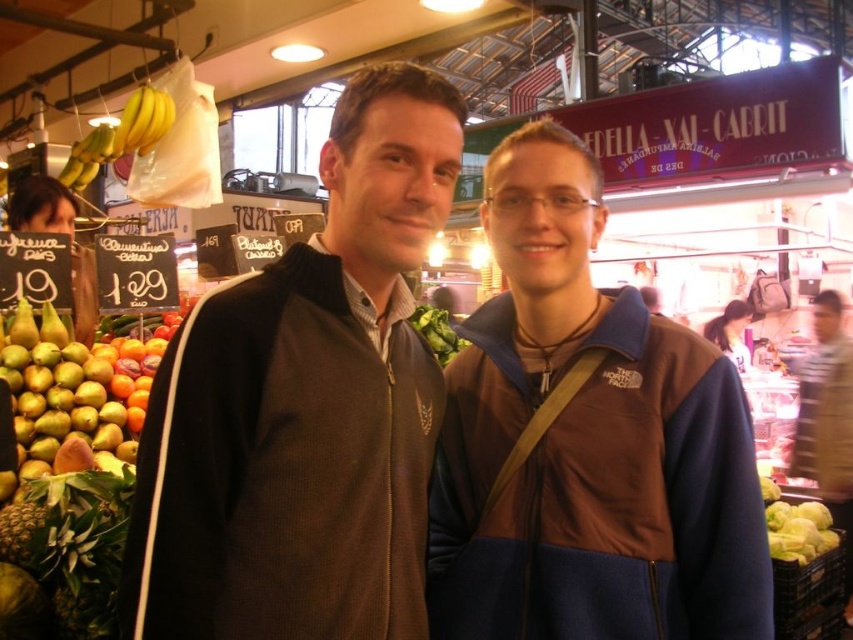
Does brown fleece jacket at center have a larger size compared to green leafy vegetable at lower right?

Indeed, brown fleece jacket at center has a larger size compared to green leafy vegetable at lower right.

Which of these two, brown fleece jacket at center or green leafy vegetable at lower right, stands shorter?

With less height is green leafy vegetable at lower right.

Which is in front, point (560, 531) or point (791, 529)?

Positioned in front is point (560, 531).

Where is `brown fleece jacket at center`? The height and width of the screenshot is (640, 853). brown fleece jacket at center is located at coordinates (585, 442).

Is point (630, 529) positioned before point (44, 566)?

Yes, it is.

Which of these two, brown fleece jacket at center or green leafy at left, stands shorter?

green leafy at left is shorter.

Image resolution: width=853 pixels, height=640 pixels. I want to click on brown fleece jacket at center, so click(x=585, y=442).

Does green leafy at left appear on the left side of green leafy at center?

Yes, green leafy at left is to the left of green leafy at center.

Locate an element on the screen. green leafy at left is located at coordinates (73, 545).